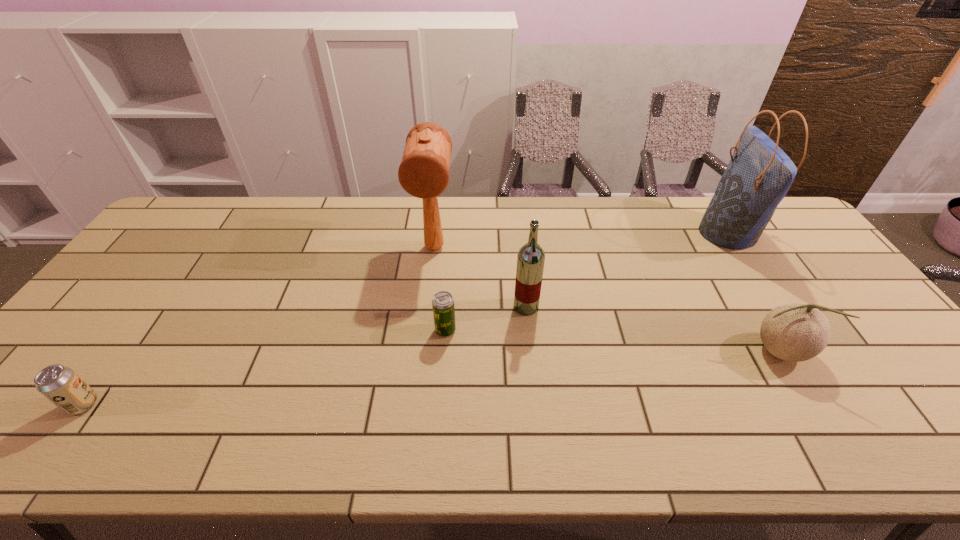
Where is `unoccupied position between the shopping bag and the liquor`? The width and height of the screenshot is (960, 540). unoccupied position between the shopping bag and the liquor is located at coordinates (627, 271).

Find the location of a particular element. The width and height of the screenshot is (960, 540). vacant region between the liquor and the fourth tallest object is located at coordinates pos(652,329).

Find the location of a particular element. empty space that is in between the mallet and the shopping bag is located at coordinates (581, 241).

Find the location of `free space between the shopping bag and the liquor`. free space between the shopping bag and the liquor is located at coordinates (627, 271).

Locate which object is the second closest to the mallet. Please provide its 2D coordinates. Your answer should be formatted as a tuple, i.e. [(x, y)], where the tuple contains the x and y coordinates of a point satisfying the conditions above.

[(530, 260)]

This screenshot has height=540, width=960. In order to click on the closest object relative to the right beer can in this screenshot , I will do `click(530, 260)`.

At what (x,y) coordinates should I click in order to perform the action: click on blank space that satisfies the following two spatial constraints: 1. on the strike surface of the mallet; 2. on the right side of the right beer can. Please return your answer as a coordinate pair (x, y). The image size is (960, 540). Looking at the image, I should click on tap(425, 330).

Where is `free point that satisfies the following two spatial constraints: 1. on the strike surface of the liquor; 2. on the right side of the mallet`? free point that satisfies the following two spatial constraints: 1. on the strike surface of the liquor; 2. on the right side of the mallet is located at coordinates (x=428, y=307).

The image size is (960, 540). What are the coordinates of `vacant space that satisfies the following two spatial constraints: 1. on the back side of the leftmost object; 2. on the left side of the right beer can` in the screenshot? It's located at (136, 330).

Locate an element on the screen. The image size is (960, 540). free space that satisfies the following two spatial constraints: 1. on the front side of the fourth tallest object; 2. on the left side of the fourth shortest object is located at coordinates (531, 350).